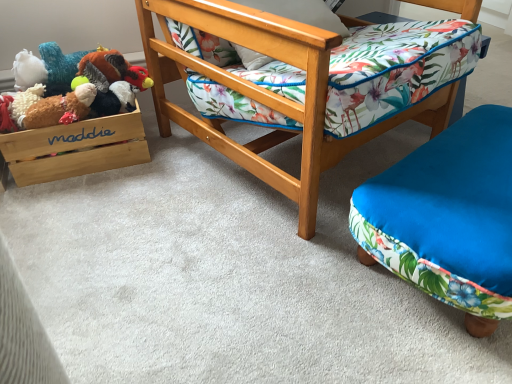
Question: Could you tell me if wooden chair at center is turned towards wooden/matte storage box at left?

Choices:
 (A) no
 (B) yes

Answer: (A)

Question: Is wooden chair at center positioned before wooden/matte storage box at left?

Choices:
 (A) no
 (B) yes

Answer: (B)

Question: Would you say wooden chair at center is outside wooden/matte storage box at left?

Choices:
 (A) no
 (B) yes

Answer: (B)

Question: Can you confirm if wooden chair at center is positioned to the right of wooden/matte storage box at left?

Choices:
 (A) yes
 (B) no

Answer: (A)

Question: Is wooden chair at center far from wooden/matte storage box at left?

Choices:
 (A) yes
 (B) no

Answer: (B)

Question: Is point (22, 170) positioned closer to the camera than point (104, 86)?

Choices:
 (A) closer
 (B) farther

Answer: (A)

Question: Looking at the image, does wooden/matte storage box at left seem bigger or smaller compared to fluffy plush turkey at upper left, marked as the second toy in a bottom-to-top arrangement?

Choices:
 (A) big
 (B) small

Answer: (A)

Question: In terms of width, does wooden/matte storage box at left look wider or thinner when compared to fluffy plush turkey at upper left, the first toy viewed from the top?

Choices:
 (A) wide
 (B) thin

Answer: (A)

Question: Considering their positions, is wooden/matte storage box at left located in front of or behind fluffy plush turkey at upper left, marked as the second toy in a bottom-to-top arrangement?

Choices:
 (A) front
 (B) behind

Answer: (A)

Question: In the image, is fluffy brown plush at left, acting as the 1th toy starting from the bottom, on the left side or the right side of wooden chair at center?

Choices:
 (A) right
 (B) left

Answer: (B)

Question: Is fluffy brown plush at left, which is the second toy in top-to-bottom order, in front of or behind wooden chair at center in the image?

Choices:
 (A) front
 (B) behind

Answer: (B)

Question: From a real-world perspective, is fluffy brown plush at left, which is the second toy in top-to-bottom order, positioned above or below wooden chair at center?

Choices:
 (A) above
 (B) below

Answer: (B)

Question: From the image's perspective, is fluffy brown plush at left, which is the second toy in top-to-bottom order, located above or below wooden chair at center?

Choices:
 (A) above
 (B) below

Answer: (B)

Question: From a real-world perspective, is fluffy brown plush at left, which is the second toy in top-to-bottom order, above or below wooden/matte storage box at left?

Choices:
 (A) below
 (B) above

Answer: (B)

Question: Is fluffy brown plush at left, which is the second toy in top-to-bottom order, inside or outside of wooden/matte storage box at left?

Choices:
 (A) outside
 (B) inside

Answer: (A)